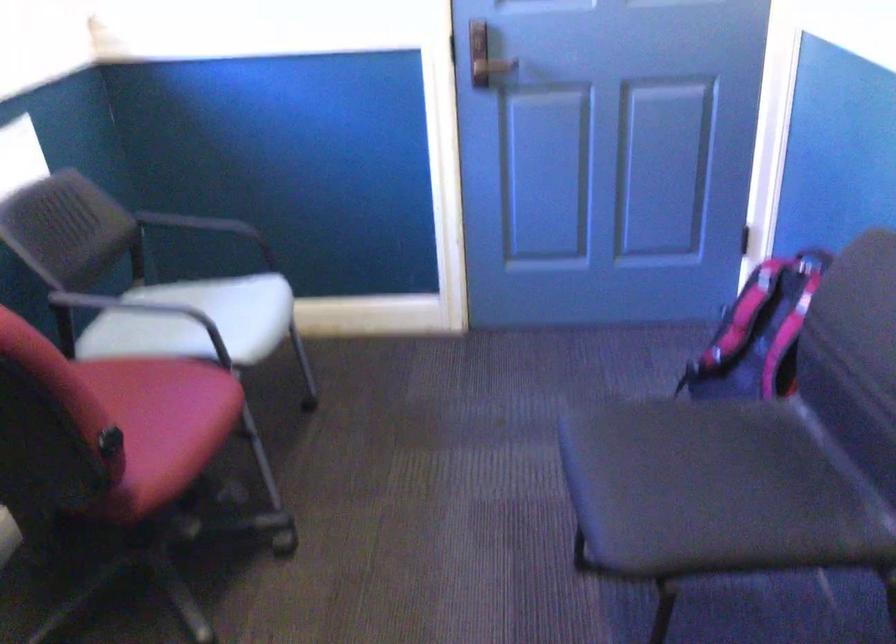
What do you see at coordinates (145, 265) in the screenshot? The image size is (896, 644). I see `the white chair sitting surface` at bounding box center [145, 265].